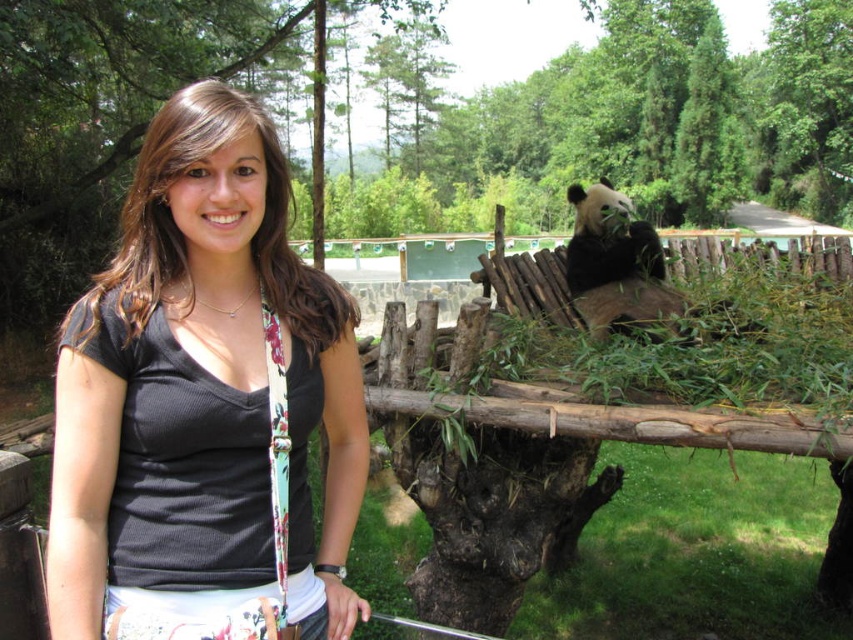
You are a photographer trying to capture a photo of the black fuzzy panda at upper right. The black fabric shirt at center is blocking your view. Can you move to the left or right to get a clear shot of the panda without the shirt blocking it?

The black fabric shirt at center is located below the black fuzzy panda at upper right. Moving to the left or right might allow you to position yourself so the shirt is no longer directly in front of the panda, but since the shirt is below the panda, adjusting your angle upwards could also help avoid the obstruction.

You are a photographer trying to capture a clear photo of the black fuzzy panda at upper right. However, the black fabric shirt at center is blocking your view. Can you move around to the left side to get an unobstructed shot?

The black fabric shirt at center is in front of the black fuzzy panda at upper right, so moving to the left side may allow you to see around the shirt and capture the panda without obstruction.

Looking at the scene at the zoo, you see a black fabric shirt at center and a black fuzzy panda at upper right. Which object is positioned to the left of the other?

The black fabric shirt at center is to the left of black fuzzy panda at upper right.